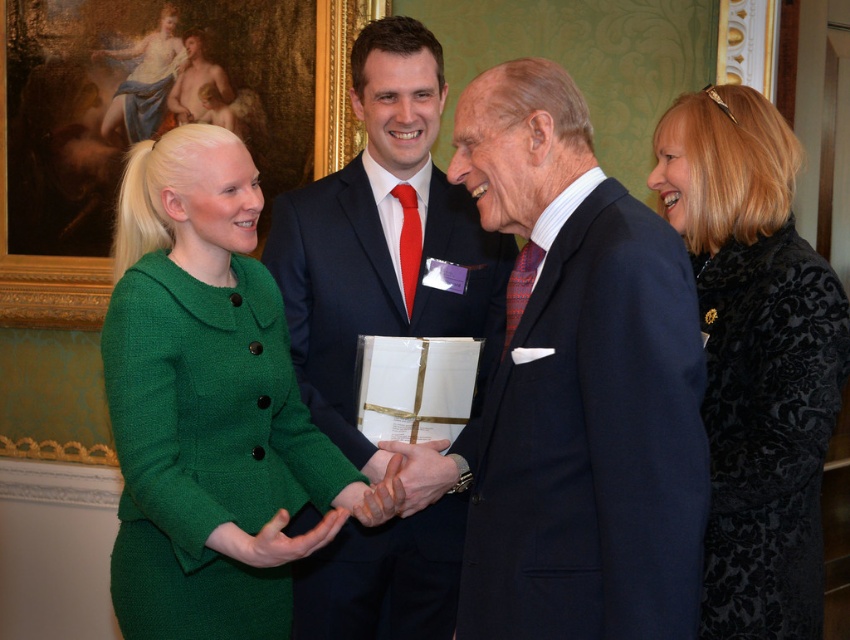
You are a fashion designer observing the scene. You notice two outfits at the center of the image. Which one is taller in height between the green woolen dress at center and the navy wool suit at center?

The green woolen dress at center is taller than the navy wool suit at center according to the description.

You are standing in the room and want to determine which of the two points, point (137, 572) or point (318, 358), is nearer to you. Based on the scene, which point is closer?

Point (137, 572) is closer to the viewer than point (318, 358).

You are a fashion designer observing the scene. You need to determine which garment takes up more visual space in the image. Which one is larger between the green woolen dress at center and the navy wool suit at center?

The green woolen dress at center is larger in size than the navy wool suit at center, so the green woolen dress at center takes up more visual space in the image.